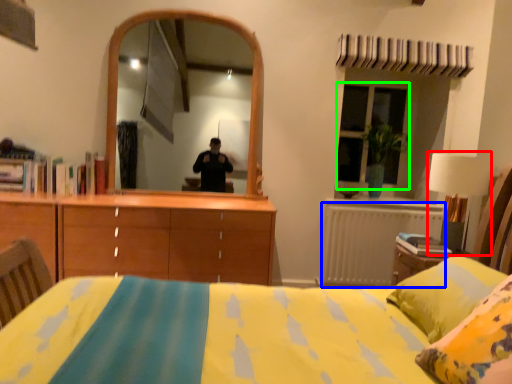
Question: Which object is positioned farthest from table lamp (highlighted by a red box)? Select from radiator (highlighted by a blue box) and window (highlighted by a green box).

Choices:
 (A) radiator
 (B) window

Answer: (B)